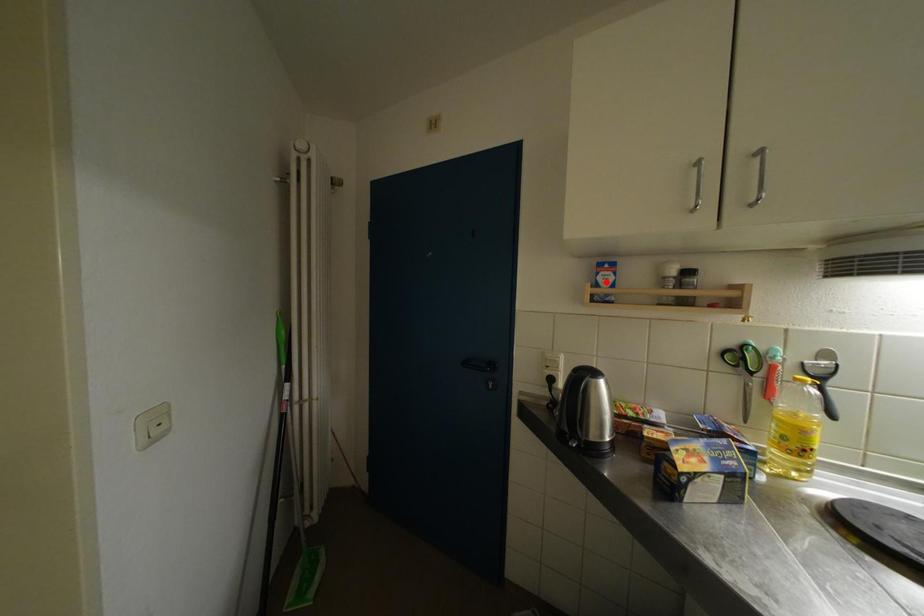
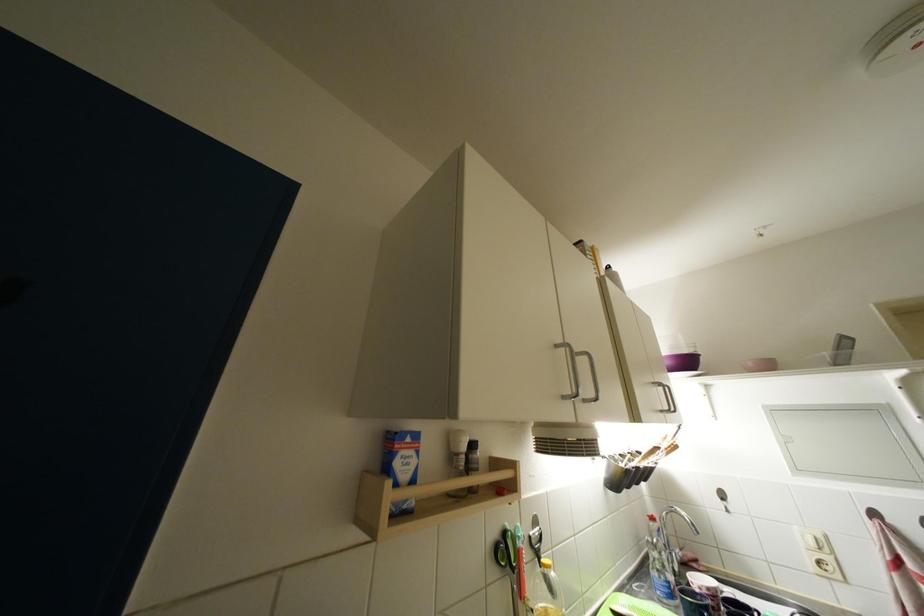
The point at the highlighted location is marked in the first image. Where is the corresponding point in the second image?

(404, 467)